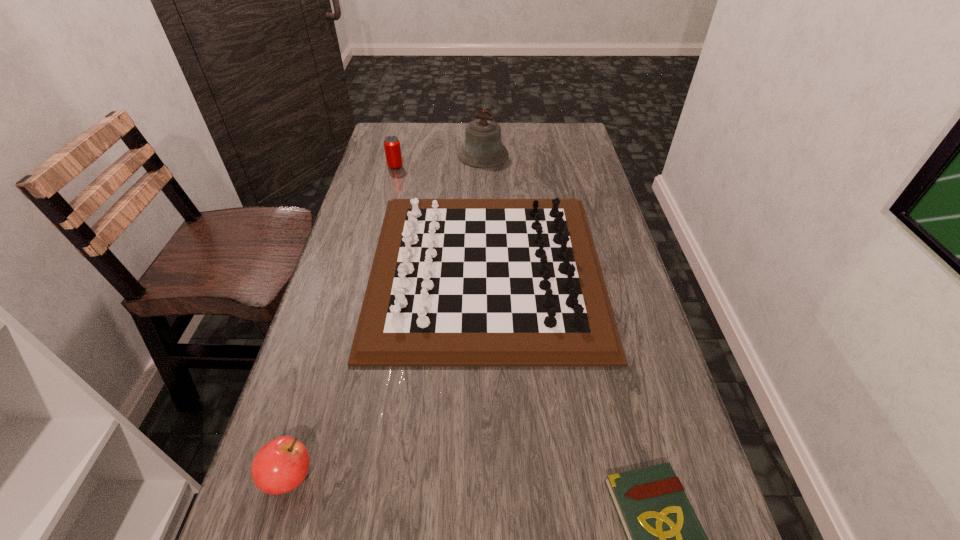
You are a GUI agent. You are given a task and a screenshot of the screen. Output one action in this format:
    pyautogui.click(x=<x>, y=<y>)
    Task: Click on the can that is at the left edge
    The image size is (960, 540).
    Given the screenshot: What is the action you would take?
    392,147

At what (x,y) coordinates should I click in order to perform the action: click on apple at the left edge. Please return your answer as a coordinate pair (x, y). Looking at the image, I should click on click(281, 465).

Locate an element on the screen. Image resolution: width=960 pixels, height=540 pixels. object at the right edge is located at coordinates (454, 282).

Locate an element on the screen. free region at the far edge is located at coordinates (533, 125).

Find the location of `blank space at the left edge`. blank space at the left edge is located at coordinates (372, 215).

Find the location of a particular element. vacant area at the right edge is located at coordinates (622, 468).

This screenshot has width=960, height=540. What are the coordinates of `vacant region at the far right corner of the desktop` in the screenshot? It's located at (540, 123).

Find the location of a particular element. The width and height of the screenshot is (960, 540). free area in between the can and the apple is located at coordinates (343, 321).

At what (x,y) coordinates should I click in order to perform the action: click on free point between the third farthest object and the apple. Please return your answer as a coordinate pair (x, y). Looking at the image, I should click on (388, 373).

Image resolution: width=960 pixels, height=540 pixels. Find the location of `free space between the gameboard and the apple`. free space between the gameboard and the apple is located at coordinates (388, 373).